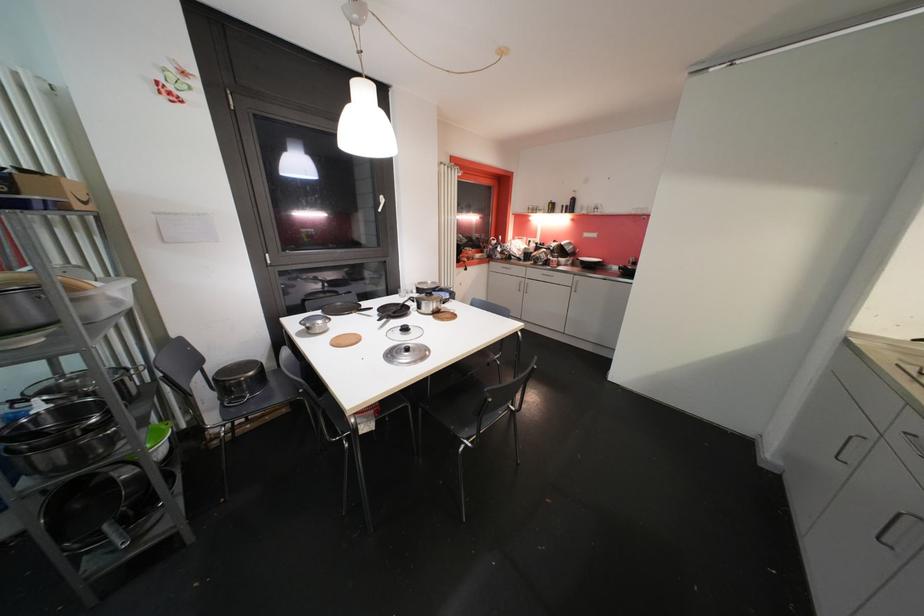
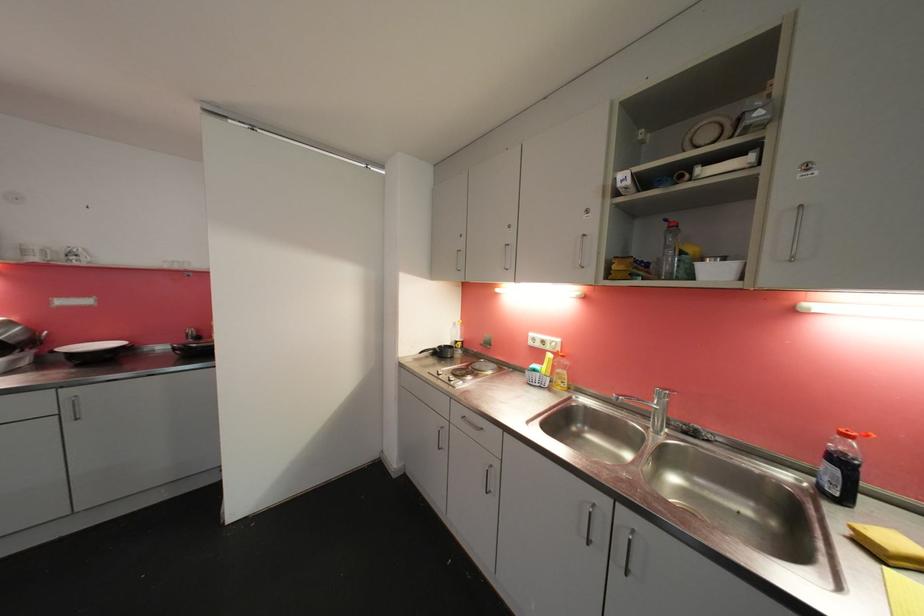
Question: The first image is from the beginning of the video and the second image is from the end. How did the camera likely rotate when shooting the video?

Choices:
 (A) Left
 (B) Right
 (C) Up
 (D) Down

Answer: (B)